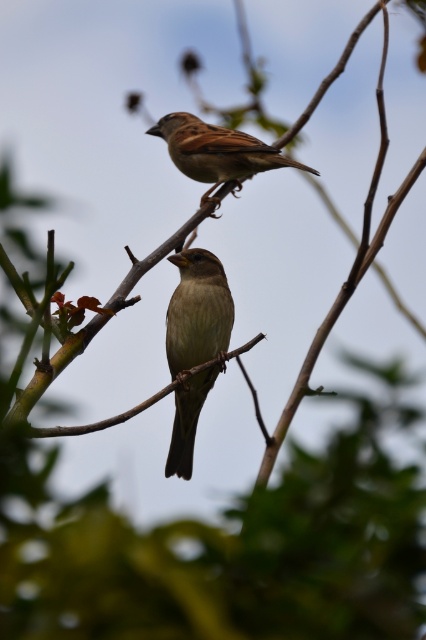
The height and width of the screenshot is (640, 426). What do you see at coordinates (195, 344) in the screenshot? I see `brown matte sparrow at center` at bounding box center [195, 344].

Can you confirm if brown matte sparrow at center is taller than brown matte sparrow at upper center?

Indeed, brown matte sparrow at center has a greater height compared to brown matte sparrow at upper center.

Is point (221, 342) closer to viewer compared to point (259, 168)?

Yes, it is in front of point (259, 168).

Locate an element on the screen. This screenshot has width=426, height=640. brown matte sparrow at center is located at coordinates (195, 344).